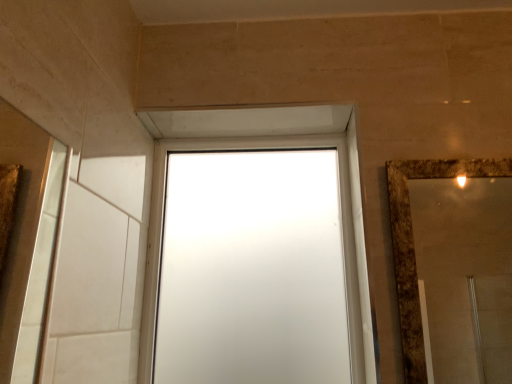
Question: Should I look upward or downward to see frosted glass window at center?

Choices:
 (A) up
 (B) down

Answer: (B)